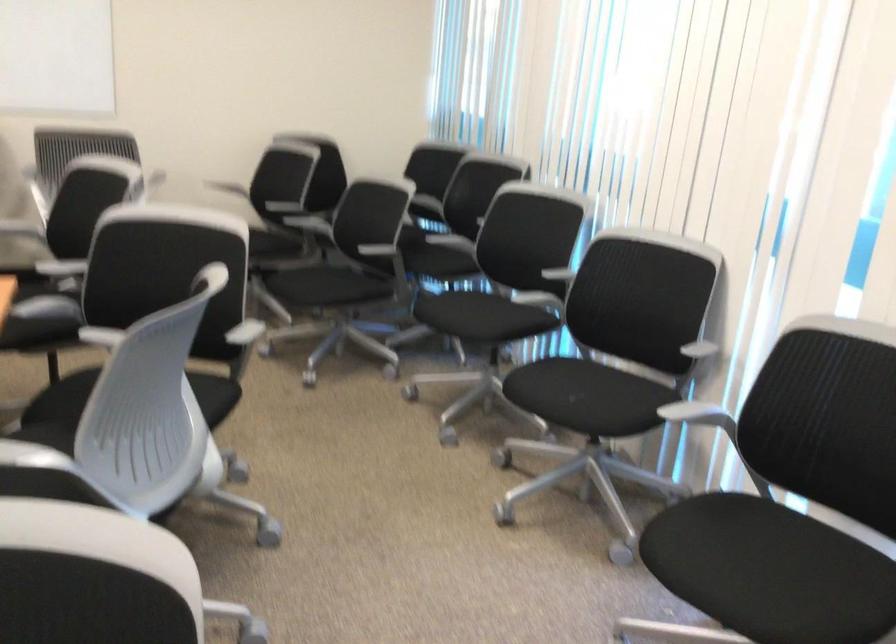
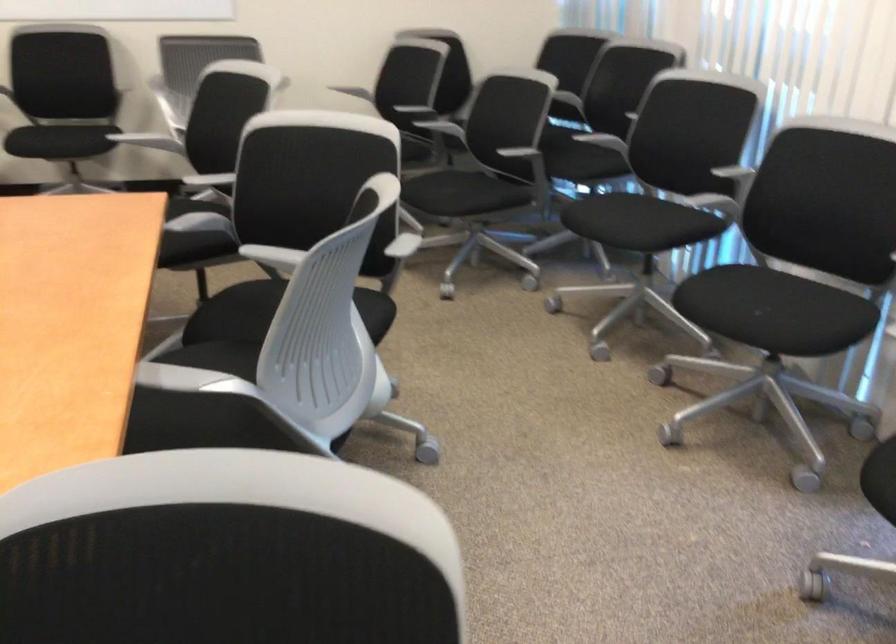
In the second image, find the point that corresponds to point 323,292 in the first image.

(462, 200)